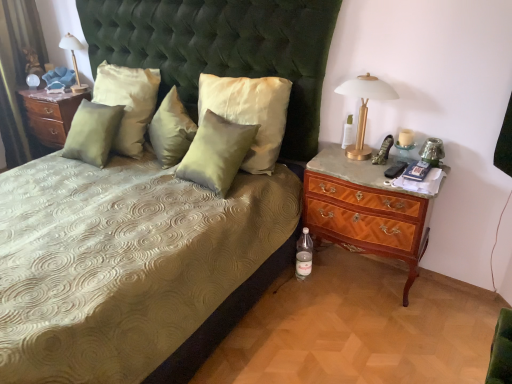
You are a GUI agent. You are given a task and a screenshot of the screen. Output one action in this format:
    pyautogui.click(x=<x>, y=<y>)
    Task: Click on the vacant space that is in between mahogany wood nightstand at right, the first nightstand when ordered from bottom to top, and clear plastic bottle at lower right, the 1th bottle from the bottom
    
    Given the screenshot: What is the action you would take?
    pyautogui.click(x=340, y=293)